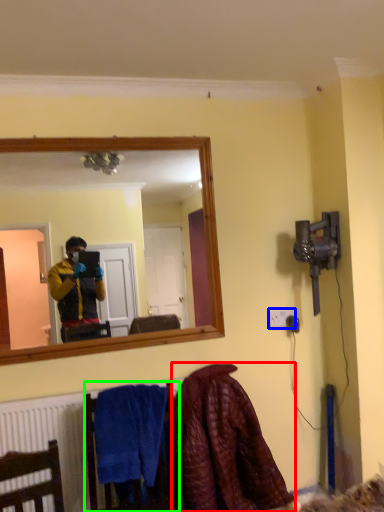
Question: Considering the real-world distances, which object is farthest from blanket (highlighted by a red box)? electric outlet (highlighted by a blue box) or armchair (highlighted by a green box)?

Choices:
 (A) electric outlet
 (B) armchair

Answer: (A)